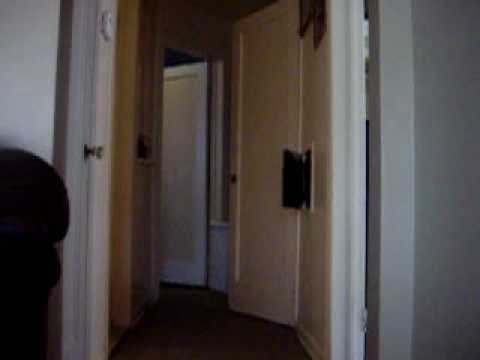
The width and height of the screenshot is (480, 360). Identify the location of door. (74, 174).